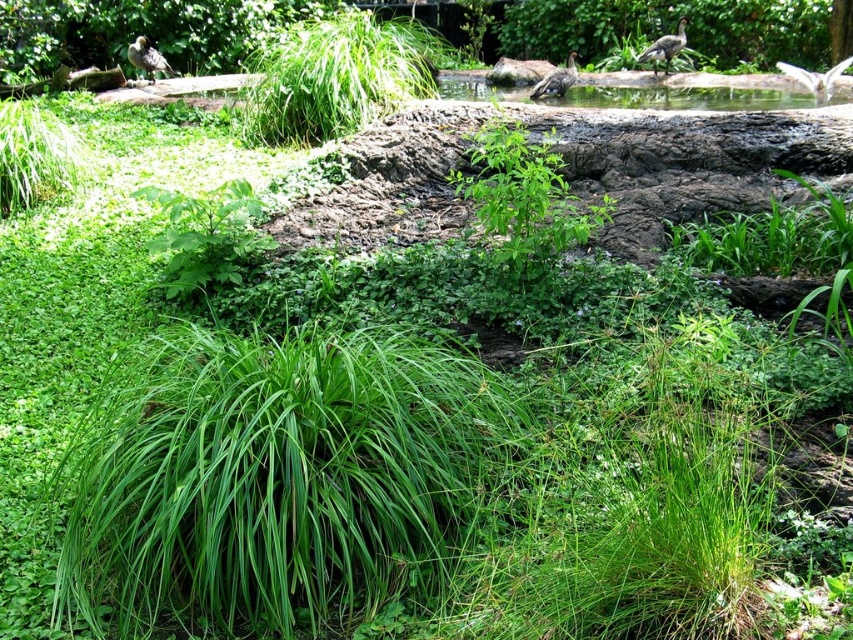
Question: Where is white feathered bird at upper right located in relation to gray feathered bird at upper right in the image?

Choices:
 (A) above
 (B) below

Answer: (B)

Question: Observing the image, what is the correct spatial positioning of white feathered bird at upper right in reference to brown feathered bird at upper center?

Choices:
 (A) above
 (B) below

Answer: (A)

Question: Which point appears farthest from the camera in this image?

Choices:
 (A) coord(506,65)
 (B) coord(558,67)
 (C) coord(134,49)
 (D) coord(788,74)

Answer: (A)

Question: Among these points, which one is farthest from the camera?

Choices:
 (A) (679, 42)
 (B) (523, 77)
 (C) (148, 51)

Answer: (B)

Question: Which point is farther to the camera?

Choices:
 (A) brown fuzzy rock at center
 (B) gray feathered bird at upper right
 (C) white feathered bird at upper right
 (D) brown feathered bird at upper left

Answer: (A)

Question: Can you confirm if gray feathered bird at upper right is positioned to the left of brown feathered bird at upper center?

Choices:
 (A) yes
 (B) no

Answer: (B)